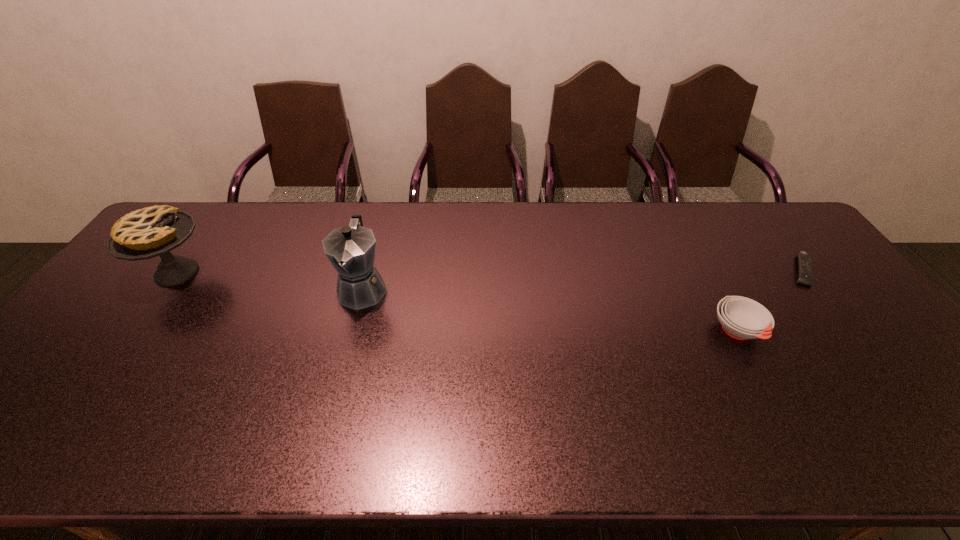
Locate an element on the screen. The height and width of the screenshot is (540, 960). free spot located on the back of the rightmost object is located at coordinates (780, 241).

Locate an element on the screen. This screenshot has width=960, height=540. object present at the left edge is located at coordinates (149, 232).

The width and height of the screenshot is (960, 540). What are the coordinates of `object present at the right edge` in the screenshot? It's located at (805, 272).

The width and height of the screenshot is (960, 540). Identify the location of vacant space at the far edge. (697, 205).

In the image, there is a desktop. Where is `vacant area at the near edge`? The height and width of the screenshot is (540, 960). vacant area at the near edge is located at coordinates (773, 446).

In the image, there is a desktop. At what (x,y) coordinates should I click in order to perform the action: click on free space at the left edge. Please return your answer as a coordinate pair (x, y). Looking at the image, I should click on click(x=124, y=273).

Locate an element on the screen. vacant region at the right edge of the desktop is located at coordinates (888, 373).

This screenshot has width=960, height=540. I want to click on free space at the far right corner of the desktop, so click(x=801, y=234).

Identify the location of free space at the near right corner of the desktop. This screenshot has width=960, height=540. (908, 425).

Image resolution: width=960 pixels, height=540 pixels. I want to click on vacant point located between the coffeepot and the pie, so click(270, 280).